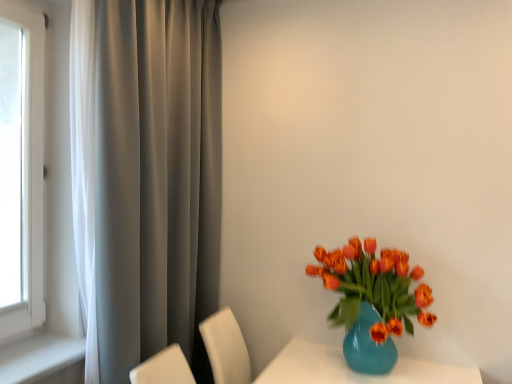
Question: From the image's perspective, is shiny orange tulips in glass vase at right above satin gray curtain at left?

Choices:
 (A) no
 (B) yes

Answer: (A)

Question: Is the depth of shiny orange tulips in glass vase at right greater than that of satin gray curtain at left?

Choices:
 (A) yes
 (B) no

Answer: (A)

Question: Considering the relative sizes of shiny orange tulips in glass vase at right and satin gray curtain at left in the image provided, is shiny orange tulips in glass vase at right bigger than satin gray curtain at left?

Choices:
 (A) no
 (B) yes

Answer: (A)

Question: Does shiny orange tulips in glass vase at right have a smaller size compared to satin gray curtain at left?

Choices:
 (A) yes
 (B) no

Answer: (A)

Question: Is shiny orange tulips in glass vase at right far away from satin gray curtain at left?

Choices:
 (A) yes
 (B) no

Answer: (B)

Question: Is shiny orange tulips in glass vase at right not inside satin gray curtain at left?

Choices:
 (A) yes
 (B) no

Answer: (A)

Question: Can you confirm if satin gray curtain at left is smaller than shiny orange tulips in glass vase at right?

Choices:
 (A) yes
 (B) no

Answer: (B)

Question: Is shiny orange tulips in glass vase at right completely or partially inside satin gray curtain at left?

Choices:
 (A) no
 (B) yes

Answer: (A)

Question: From a real-world perspective, is satin gray curtain at left on top of shiny orange tulips in glass vase at right?

Choices:
 (A) no
 (B) yes

Answer: (B)

Question: Is satin gray curtain at left shorter than shiny orange tulips in glass vase at right?

Choices:
 (A) yes
 (B) no

Answer: (B)

Question: Would you consider satin gray curtain at left to be distant from shiny orange tulips in glass vase at right?

Choices:
 (A) yes
 (B) no

Answer: (B)

Question: Does satin gray curtain at left come behind shiny orange tulips in glass vase at right?

Choices:
 (A) no
 (B) yes

Answer: (A)

Question: Is shiny orange tulips in glass vase at right bigger or smaller than satin gray curtain at left?

Choices:
 (A) small
 (B) big

Answer: (A)